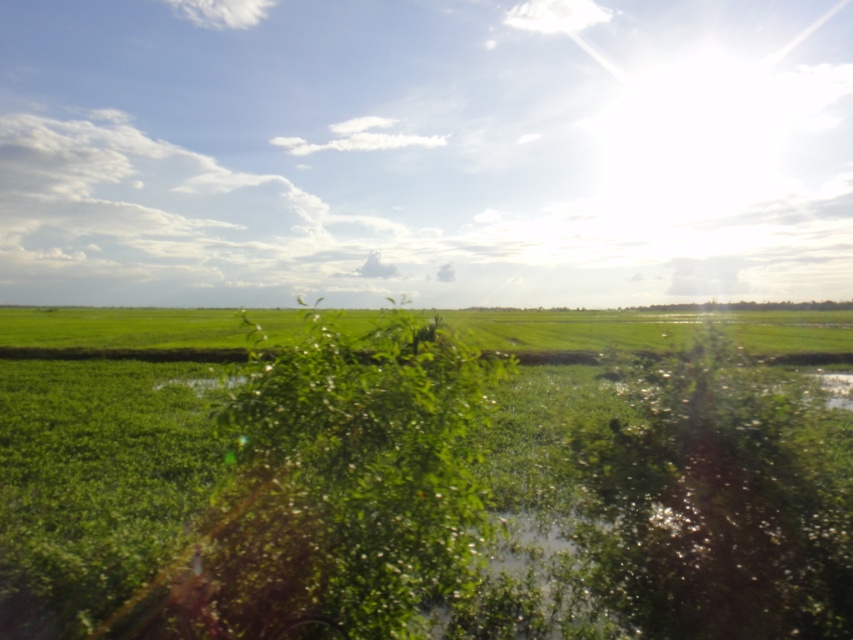
Question: Does green grassy wetland at center appear on the right side of green leafy plant at center?

Choices:
 (A) yes
 (B) no

Answer: (B)

Question: Which point is farther to the camera?

Choices:
 (A) green leafy plant at center
 (B) green grass at center
 (C) green grassy wetland at center

Answer: (B)

Question: Is green grassy wetland at center to the left of green leafy plant at center from the viewer's perspective?

Choices:
 (A) yes
 (B) no

Answer: (A)

Question: Is green leafy plant at center below green grass at center?

Choices:
 (A) no
 (B) yes

Answer: (B)

Question: Estimate the real-world distances between objects in this image. Which object is closer to the green grassy wetland at center?

Choices:
 (A) green leafy plant at center
 (B) green grass at center

Answer: (A)

Question: Which of these objects is positioned closest to the green grassy wetland at center?

Choices:
 (A) green leafy plant at center
 (B) green grass at center

Answer: (A)